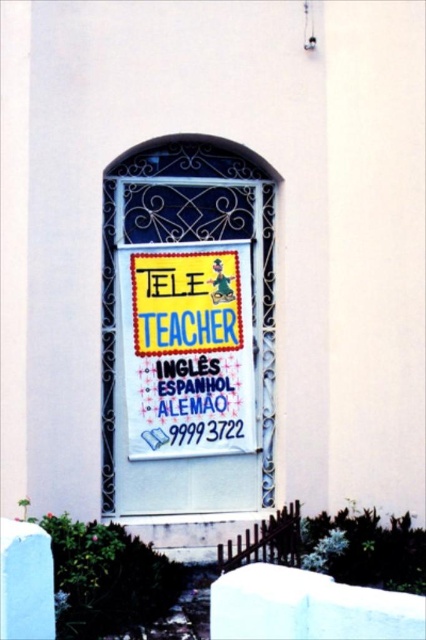
Question: Can you confirm if white paper sign at center is wider than yellow fabric poster at center?

Choices:
 (A) no
 (B) yes

Answer: (B)

Question: Is white paper sign at center bigger than yellow fabric poster at center?

Choices:
 (A) no
 (B) yes

Answer: (B)

Question: Which of the following is the farthest from the observer?

Choices:
 (A) yellow fabric poster at center
 (B) white paper sign at center

Answer: (A)

Question: Which point appears farthest from the camera in this image?

Choices:
 (A) (213, 448)
 (B) (120, 202)

Answer: (A)

Question: Is white paper sign at center bigger than yellow fabric poster at center?

Choices:
 (A) no
 (B) yes

Answer: (B)